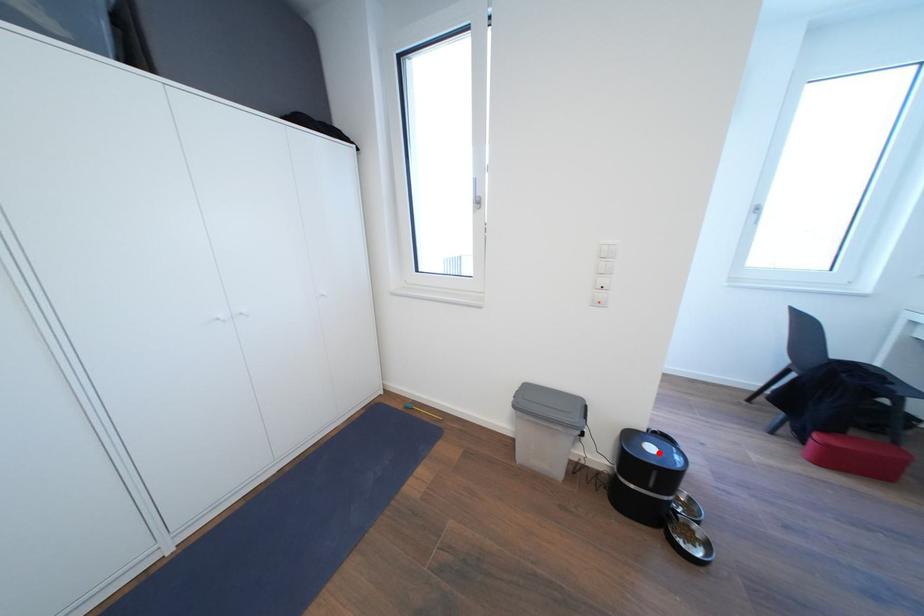
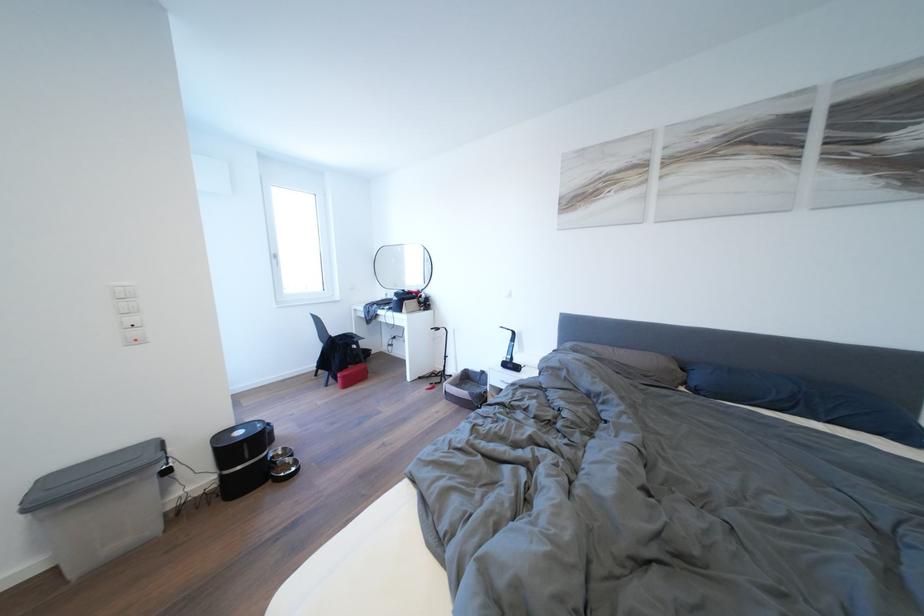
Question: I am providing you with two images of the same scene from different viewpoints. Image1 has a red point marked. In image2, the corresponding 3D location appears at what relative position? Reply with the corresponding letter.

Choices:
 (A) Closer
 (B) Farther

Answer: (A)